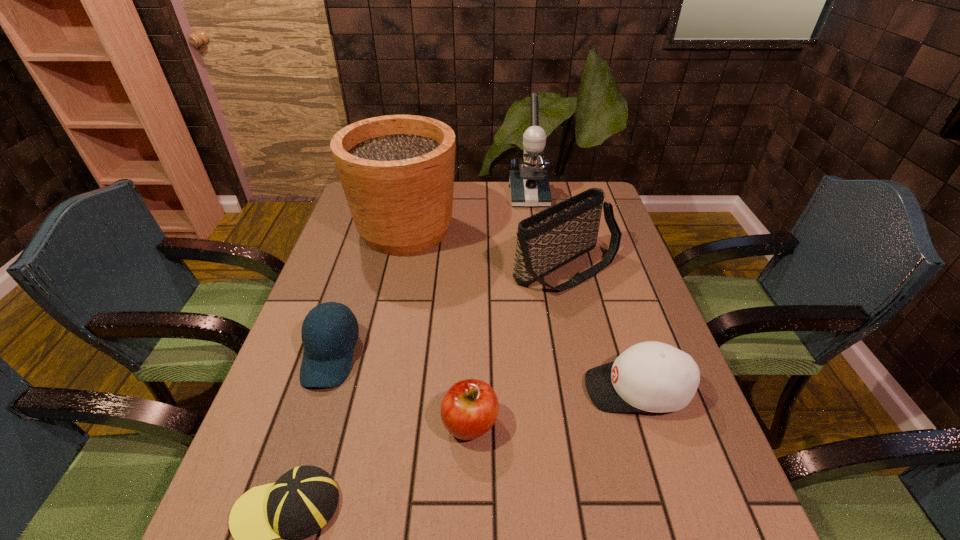
Locate an element on the screen. The height and width of the screenshot is (540, 960). free location located 0.130m on the front-facing side of the rightmost baseball cap is located at coordinates (526, 389).

Locate an element on the screen. Image resolution: width=960 pixels, height=540 pixels. vacant space located on the front of the apple is located at coordinates (468, 508).

Where is `microscope at the far edge`? The image size is (960, 540). microscope at the far edge is located at coordinates (529, 186).

In order to click on flowerpot that is at the far edge in this screenshot , I will do `click(397, 171)`.

What are the coordinates of `flowerpot located in the left edge section of the desktop` in the screenshot? It's located at click(x=397, y=171).

What are the coordinates of `baseball cap that is at the left edge` in the screenshot? It's located at (327, 358).

Locate an element on the screen. The height and width of the screenshot is (540, 960). handbag at the right edge is located at coordinates (546, 241).

Image resolution: width=960 pixels, height=540 pixels. Identify the location of baseball cap that is at the right edge. (651, 376).

The width and height of the screenshot is (960, 540). In order to click on object that is at the far left corner in this screenshot , I will do `click(397, 171)`.

This screenshot has height=540, width=960. What are the coordinates of `free space at the far edge of the desktop` in the screenshot? It's located at click(x=483, y=211).